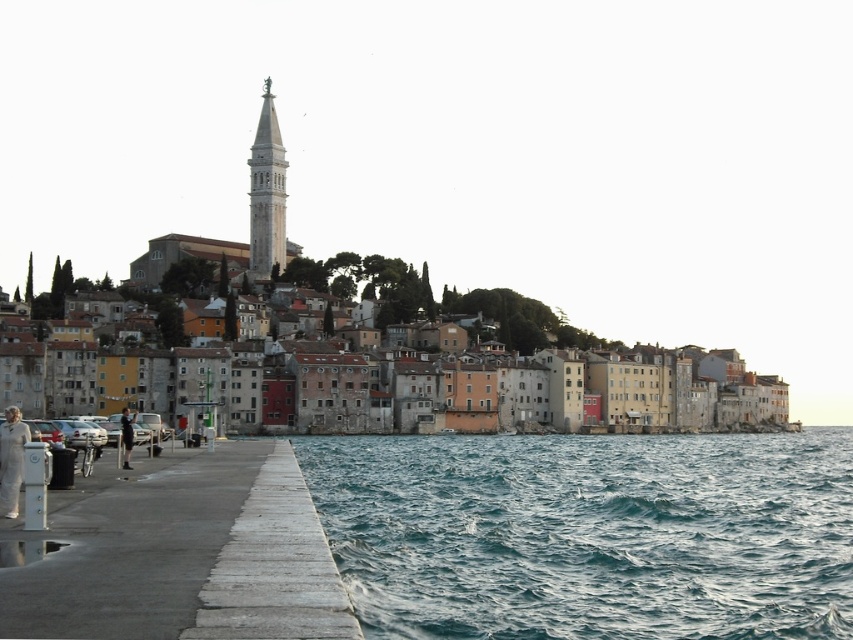
You are standing at the center of the coastal town and want to take a photo of the teal water at lower right. Which direction should you face to capture it in your shot?

You should face the lower right direction to capture the teal water at lower right in your shot since its 2D location is at point (589, 532).

You are a tourist standing at the waterfront in this coastal town. You see the teal water at lower right and the white concrete dock at lower left. Which one is positioned to the right side of the other?

The teal water at lower right is positioned to the right of the white concrete dock at lower left.